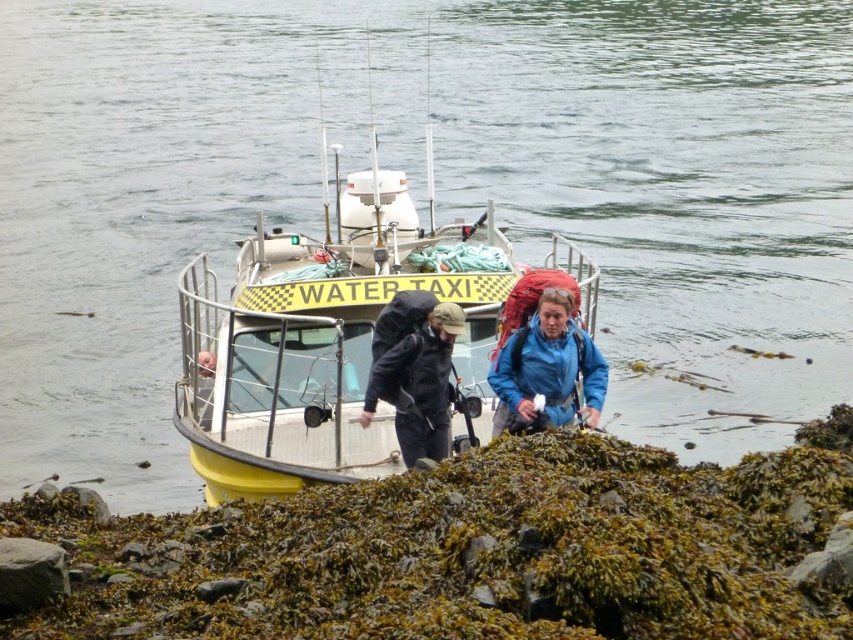
You are standing at point (x=373, y=380) and want to walk to the water taxi docked at the rocky shoreline. Which direction should you move relative to point (x=422, y=410)?

You should move towards point (x=422, y=410) because it is behind point (x=373, y=380), so moving toward it would take you in the direction of the water taxi dock.

You are a passenger on the water taxi and need to retrieve your black matte backpack at center from the dock. The blue matte jacket at center is in the way. Can you lift the backpack without moving the jacket?

The black matte backpack at center is positioned under the blue matte jacket at center, so you can lift the backpack without needing to move the jacket.

Consider the image. You are a luggage inspector at the water taxi dock. You need to determine if both the black matte backpack at center and the blue fabric backpack at center can fit into the storage compartment, which has a maximum capacity of 20 liters. Given their sizes, can both backpacks be stored together?

The black matte backpack at center is bigger than the blue fabric backpack at center. However, without knowing their exact sizes, it is impossible to determine if both can fit into the 20 liter storage compartment.